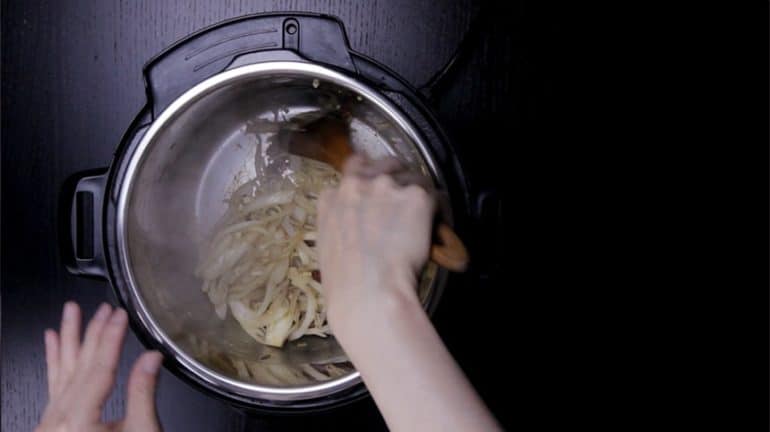
Find the location of a particular element. The image size is (770, 432). power cord is located at coordinates (433, 81).